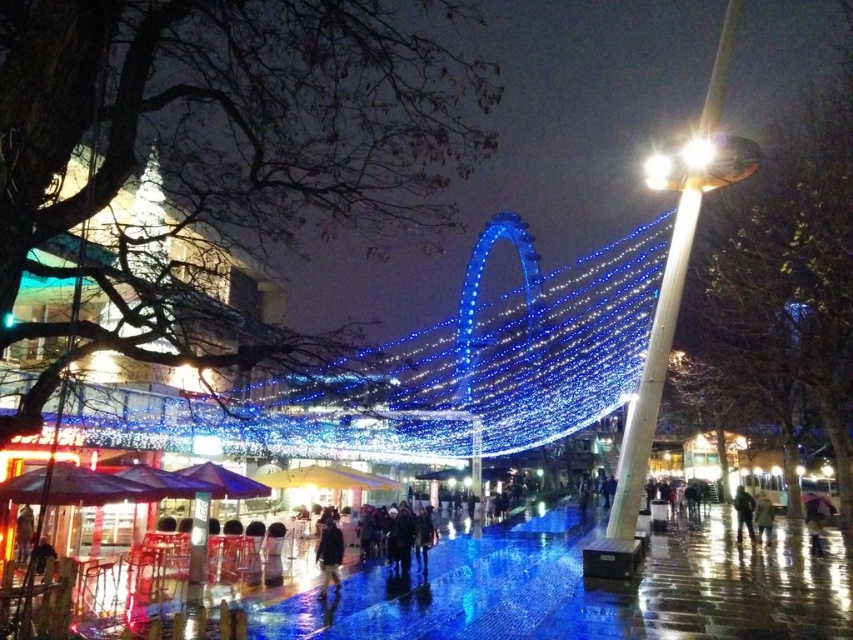
Question: Which of the following is the closest to the observer?

Choices:
 (A) (482, 573)
 (B) (321, 556)
 (C) (738, 486)

Answer: (B)

Question: Which of the following is the closest to the observer?

Choices:
 (A) dark blue jacket at center
 (B) matte plastic chairs at lower left

Answer: (B)

Question: Is matte plastic chairs at lower left to the right of dark blue fabric jacket at center from the viewer's perspective?

Choices:
 (A) yes
 (B) no

Answer: (A)

Question: Among these objects, which one is farthest from the camera?

Choices:
 (A) matte plastic chairs at lower left
 (B) dark blue jacket at center
 (C) dark blue fabric jacket at center

Answer: (B)

Question: From the image, what is the correct spatial relationship of matte plastic chairs at lower left in relation to dark blue jacket at center?

Choices:
 (A) above
 (B) below

Answer: (B)

Question: Is dark blue fabric jacket at center to the right of dark blue jacket at center from the viewer's perspective?

Choices:
 (A) yes
 (B) no

Answer: (B)